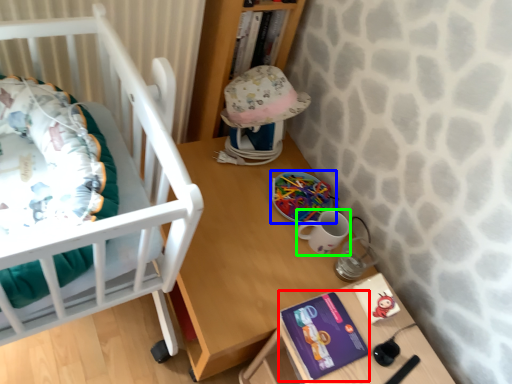
Question: Estimate the real-world distances between objects in this image. Which object is closer to paperback book (highlighted by a red box), toy (highlighted by a blue box) or mug (highlighted by a green box)?

Choices:
 (A) toy
 (B) mug

Answer: (B)